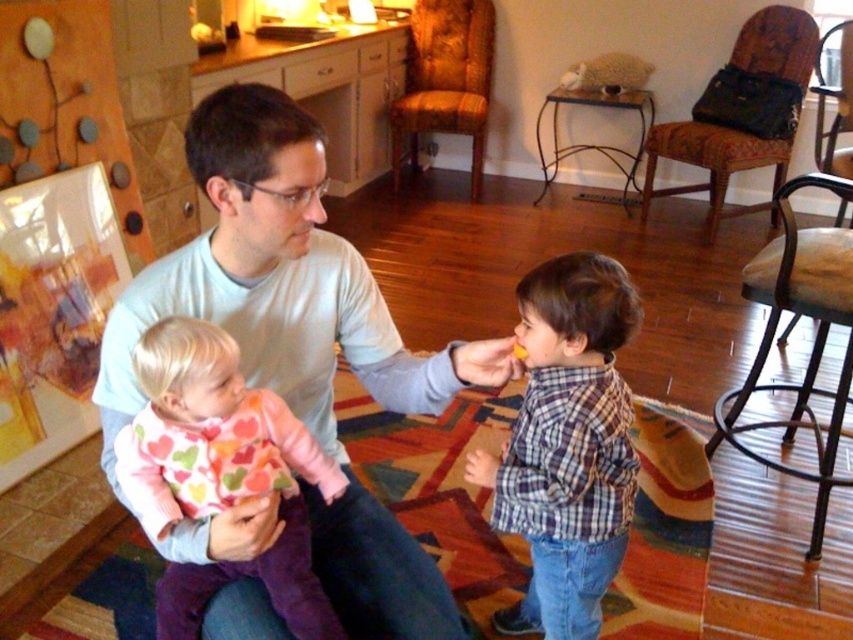
Question: Where is light blue long-sleeve shirt at center located in relation to pink heart-patterned sweater at left in the image?

Choices:
 (A) below
 (B) above

Answer: (B)

Question: Which object appears farthest from the camera in this image?

Choices:
 (A) plaid cotton shirt at center
 (B) light blue long-sleeve shirt at center

Answer: (A)

Question: Where is light blue long-sleeve shirt at center located in relation to plaid cotton shirt at center in the image?

Choices:
 (A) below
 (B) above

Answer: (B)

Question: Is light blue long-sleeve shirt at center smaller than pink heart-patterned sweater at left?

Choices:
 (A) no
 (B) yes

Answer: (A)

Question: Among these points, which one is farthest from the camera?

Choices:
 (A) (157, 467)
 (B) (505, 484)

Answer: (B)

Question: Estimate the real-world distances between objects in this image. Which object is closer to the pink heart-patterned sweater at left?

Choices:
 (A) plaid cotton shirt at center
 (B) light blue long-sleeve shirt at center

Answer: (B)